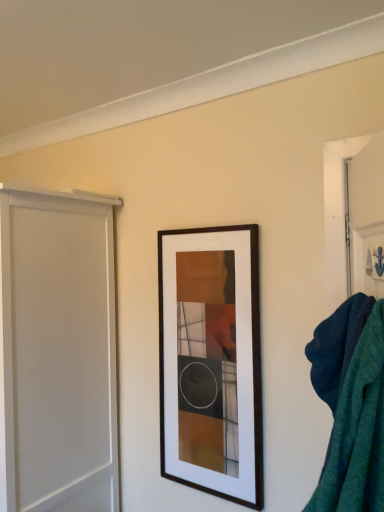
What do you see at coordinates (351, 405) in the screenshot?
I see `teal fabric bath towel at right` at bounding box center [351, 405].

This screenshot has height=512, width=384. I want to click on wooden picture frame at center, so click(211, 361).

The image size is (384, 512). In order to click on white matte screen door at left in this screenshot , I will do `click(57, 352)`.

Looking at this image, are white matte screen door at left and teal fabric bath towel at right far apart?

Yes.

Does point (84, 381) appear closer or farther from the camera than point (362, 358)?

Point (84, 381) appears to be farther away from the viewer than point (362, 358).

Is white matte screen door at left wider than teal fabric bath towel at right?

Indeed, white matte screen door at left has a greater width compared to teal fabric bath towel at right.

You are a GUI agent. You are given a task and a screenshot of the screen. Output one action in this format:
    pyautogui.click(x=<x>, y=<y>)
    Task: Click on the screen door on the left of the teal fabric bath towel at right
    
    Given the screenshot: What is the action you would take?
    pyautogui.click(x=57, y=352)

From a real-world perspective, is teal fabric bath towel at right positioned under white matte screen door at left based on gravity?

Result: No.

Considering the relative sizes of teal fabric bath towel at right and white matte screen door at left in the image provided, is teal fabric bath towel at right smaller than white matte screen door at left?

Correct, teal fabric bath towel at right occupies less space than white matte screen door at left.

Is white matte screen door at left at the back of teal fabric bath towel at right?

No, teal fabric bath towel at right's orientation is not away from white matte screen door at left.

How many degrees apart are the facing directions of teal fabric bath towel at right and white matte screen door at left?

teal fabric bath towel at right and white matte screen door at left are facing 69.6 degrees away from each other.

Could you tell me if wooden picture frame at center is turned towards teal fabric bath towel at right?

No.

Considering the sizes of objects wooden picture frame at center and teal fabric bath towel at right in the image provided, who is taller, wooden picture frame at center or teal fabric bath towel at right?

With more height is wooden picture frame at center.

Which is in front, point (196, 368) or point (371, 465)?

The point (371, 465) is in front.

From the image's perspective, between wooden picture frame at center and teal fabric bath towel at right, which one is located above?

teal fabric bath towel at right.

Is wooden picture frame at center positioned beyond the bounds of white matte screen door at left?

Yes, wooden picture frame at center is located beyond the bounds of white matte screen door at left.

From the image's perspective, is wooden picture frame at center above or below white matte screen door at left?

Clearly, from the image's perspective, wooden picture frame at center is above white matte screen door at left.

Is wooden picture frame at center bigger or smaller than white matte screen door at left?

Clearly, wooden picture frame at center is smaller in size than white matte screen door at left.

Does wooden picture frame at center have a greater width compared to white matte screen door at left?

Incorrect, the width of wooden picture frame at center does not surpass that of white matte screen door at left.

From the image's perspective, does white matte screen door at left appear lower than wooden picture frame at center?

Yes.

From the picture: Considering the sizes of white matte screen door at left and wooden picture frame at center in the image, is white matte screen door at left wider or thinner than wooden picture frame at center?

In the image, white matte screen door at left appears to be wider than wooden picture frame at center.

Would you consider white matte screen door at left to be distant from wooden picture frame at center?

No.

Does teal fabric bath towel at right come behind wooden picture frame at center?

No, teal fabric bath towel at right is in front of wooden picture frame at center.

Based on their sizes in the image, would you say teal fabric bath towel at right is bigger or smaller than wooden picture frame at center?

Clearly, teal fabric bath towel at right is smaller in size than wooden picture frame at center.

Which of these two, teal fabric bath towel at right or wooden picture frame at center, stands shorter?

teal fabric bath towel at right is shorter.

Between teal fabric bath towel at right and wooden picture frame at center, which one appears on the right side from the viewer's perspective?

teal fabric bath towel at right is more to the right.

The image size is (384, 512). Find the location of `bath towel lying on the right of white matte screen door at left`. bath towel lying on the right of white matte screen door at left is located at coordinates (351, 405).

In the image, there is a teal fabric bath towel at right. At what (x,y) coordinates should I click in order to perform the action: click on screen door below it (from a real-world perspective). Please return your answer as a coordinate pair (x, y). This screenshot has height=512, width=384. Looking at the image, I should click on (57, 352).

Based on their spatial positions, is white matte screen door at left or wooden picture frame at center closer to teal fabric bath towel at right?

wooden picture frame at center.

Estimate the real-world distances between objects in this image. Which object is further from teal fabric bath towel at right, wooden picture frame at center or white matte screen door at left?

The object further to teal fabric bath towel at right is white matte screen door at left.

Estimate the real-world distances between objects in this image. Which object is closer to white matte screen door at left, teal fabric bath towel at right or wooden picture frame at center?

wooden picture frame at center is positioned closer to the anchor white matte screen door at left.

Considering their positions, is teal fabric bath towel at right positioned further to wooden picture frame at center than white matte screen door at left?

The object further to wooden picture frame at center is teal fabric bath towel at right.

Considering their positions, is wooden picture frame at center positioned further to white matte screen door at left than teal fabric bath towel at right?

teal fabric bath towel at right is positioned further to the anchor white matte screen door at left.

Estimate the real-world distances between objects in this image. Which object is further from wooden picture frame at center, white matte screen door at left or teal fabric bath towel at right?

Among the two, teal fabric bath towel at right is located further to wooden picture frame at center.

This screenshot has height=512, width=384. I want to click on picture frame located between white matte screen door at left and teal fabric bath towel at right in the left-right direction, so click(211, 361).